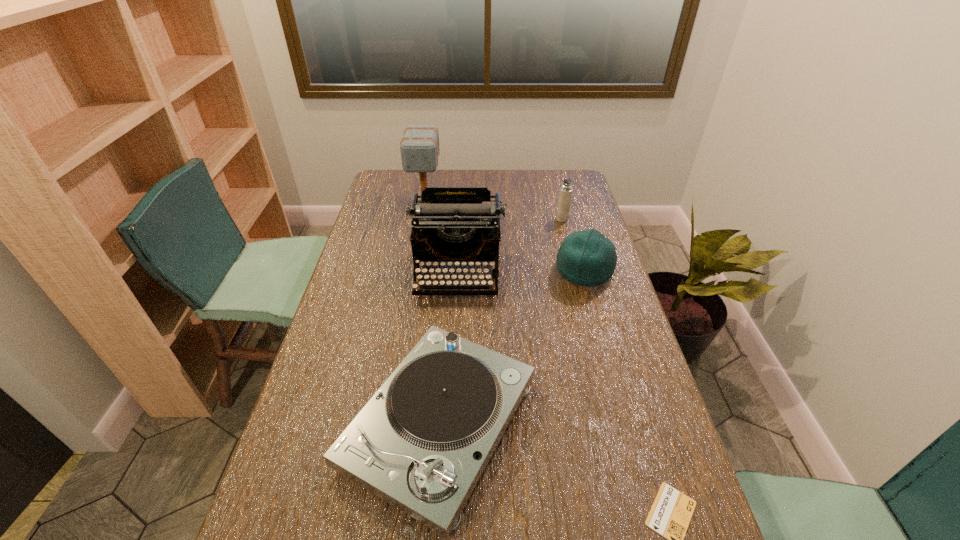
You are a GUI agent. You are given a task and a screenshot of the screen. Output one action in this format:
    pyautogui.click(x=<x>, y=<y>)
    Task: Click on the mallet
    
    Given the screenshot: What is the action you would take?
    click(419, 147)

Identify the location of typewriter. (455, 226).

At what (x,y) coordinates should I click in order to perform the action: click on thermos bottle. Please return your answer as a coordinate pair (x, y). The width and height of the screenshot is (960, 540). Looking at the image, I should click on (565, 194).

This screenshot has height=540, width=960. I want to click on beanie, so click(x=587, y=258).

The image size is (960, 540). I want to click on free space located on the striking surface of the farthest object, so click(414, 264).

You are a GUI agent. You are given a task and a screenshot of the screen. Output one action in this format:
    pyautogui.click(x=<x>, y=<y>)
    Task: Click on the vacant region located 0.330m on the typing side of the fifth shortest object
    
    Given the screenshot: What is the action you would take?
    pyautogui.click(x=450, y=393)

Where is `vacant space located on the left of the thermos bottle`? vacant space located on the left of the thermos bottle is located at coordinates (496, 219).

Where is `vacant space located on the front of the beanie`? The image size is (960, 540). vacant space located on the front of the beanie is located at coordinates (612, 367).

Identify the location of object that is at the far edge. (419, 147).

What are the coordinates of `object that is at the left edge` in the screenshot? It's located at (419, 147).